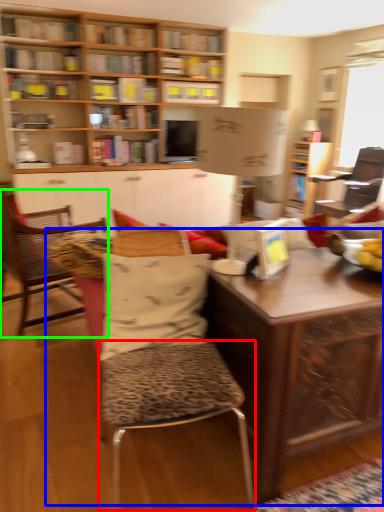
Question: Which is nearer to the bar stool (highlighted by a red box)? table (highlighted by a blue box) or chair (highlighted by a green box).

Choices:
 (A) table
 (B) chair

Answer: (A)